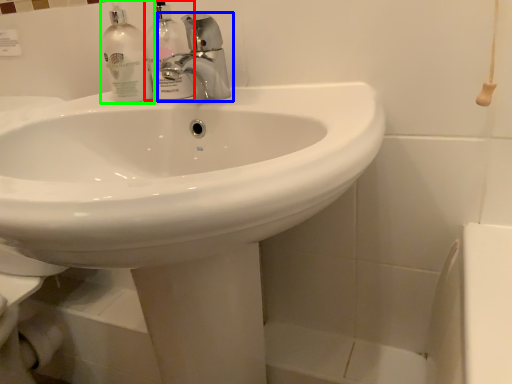
Question: Estimate the real-world distances between objects in this image. Which object is closer to cleaning product (highlighted by a red box), tap (highlighted by a blue box) or cleaning product (highlighted by a green box)?

Choices:
 (A) tap
 (B) cleaning product

Answer: (B)